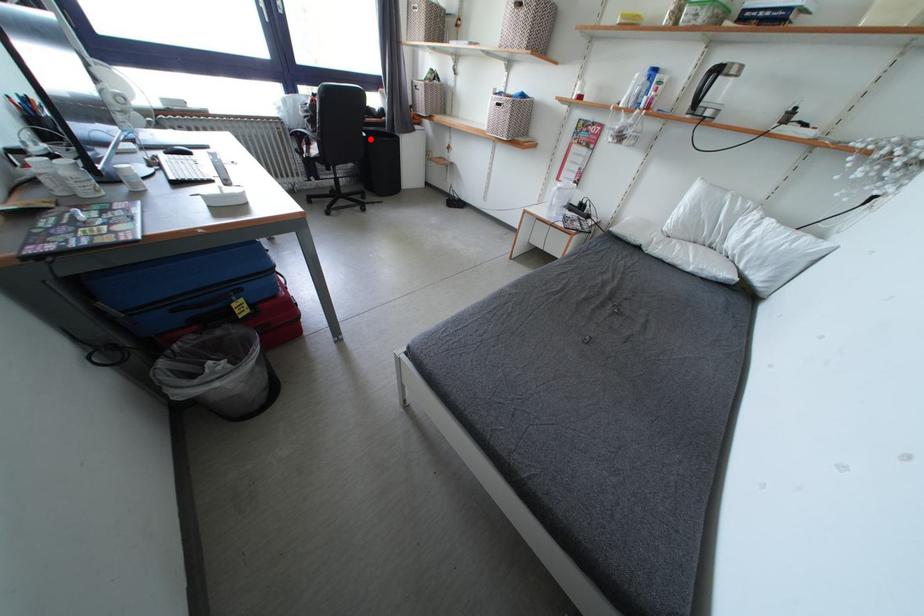
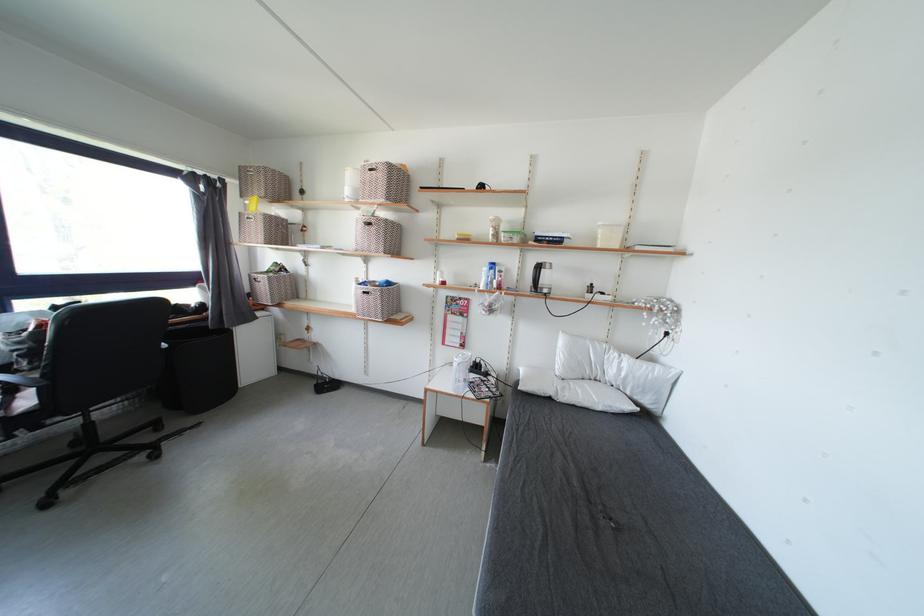
Question: I am providing you with two images of the same scene from different viewpoints. A red point is shown in image1. For the corresponding object point in image2, is it positioned nearer or farther from the camera?

Choices:
 (A) Nearer
 (B) Farther

Answer: (B)